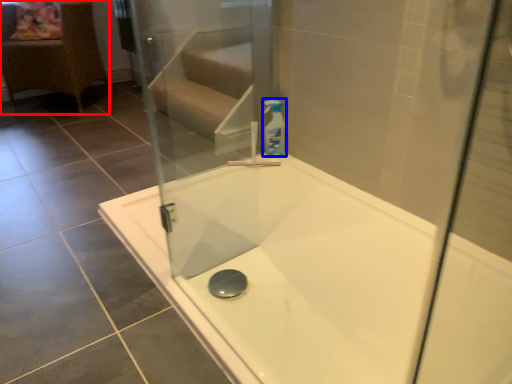
Question: Among these objects, which one is nearest to the camera, furniture (highlighted by a red box) or cleaning product (highlighted by a blue box)?

Choices:
 (A) furniture
 (B) cleaning product

Answer: (B)